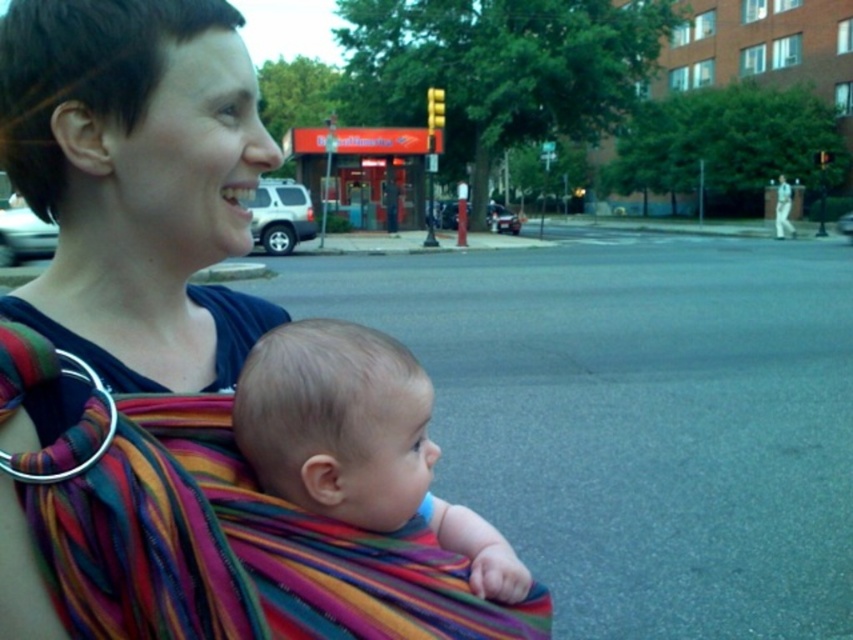
Question: Which point is farther from the camera taking this photo?

Choices:
 (A) (152, 502)
 (B) (312, 320)

Answer: (B)

Question: Does multicolored woven carrier at center have a larger size compared to soft beige baby at center?

Choices:
 (A) no
 (B) yes

Answer: (B)

Question: Which point is farther from the camera taking this photo?

Choices:
 (A) (166, 214)
 (B) (265, 435)

Answer: (A)

Question: Is multicolored woven carrier at center positioned behind soft beige baby at center?

Choices:
 (A) yes
 (B) no

Answer: (B)

Question: Does multicolored woven carrier at center appear on the right side of soft beige baby at center?

Choices:
 (A) no
 (B) yes

Answer: (A)